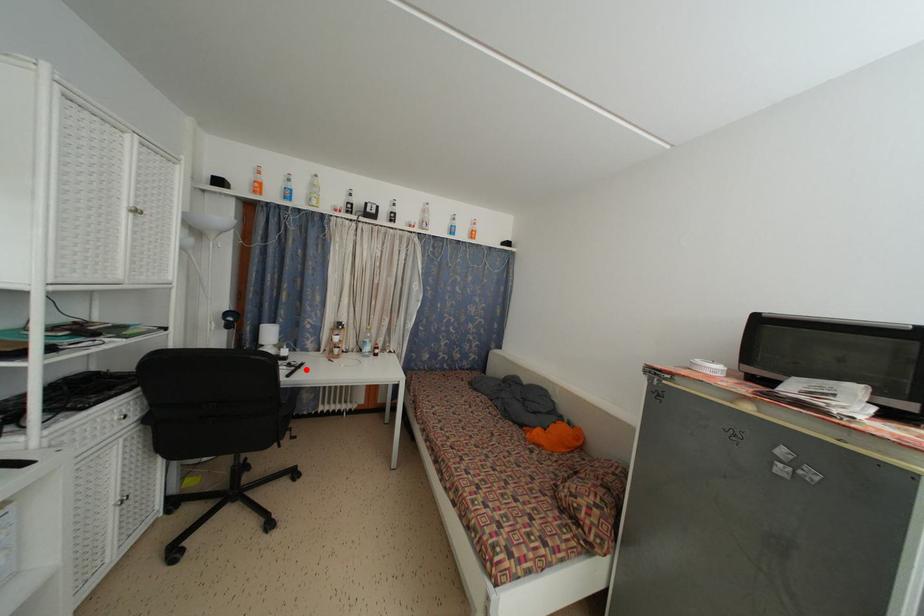
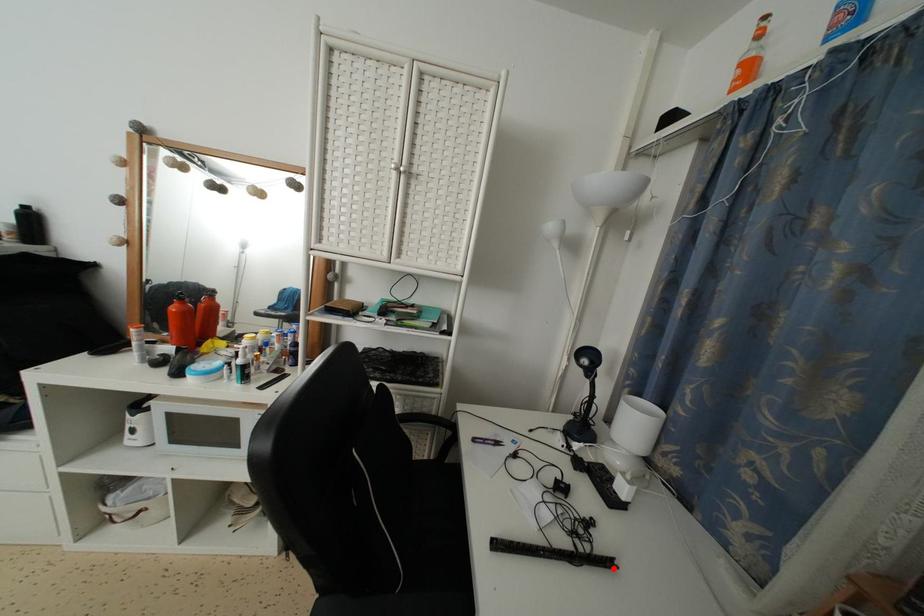
I am providing you with two images of the same scene from different viewpoints. A red point is marked on the first image and another point is marked on the second image. Do the highlighted points in image1 and image2 indicate the same real-world spot?

Yes